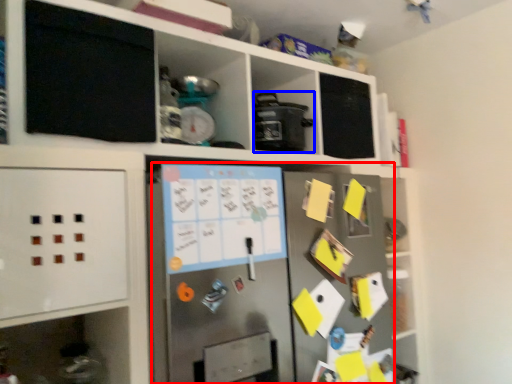
Question: Which point is further to the camera, fridge (highlighted by a red box) or appliance (highlighted by a blue box)?

Choices:
 (A) fridge
 (B) appliance

Answer: (B)